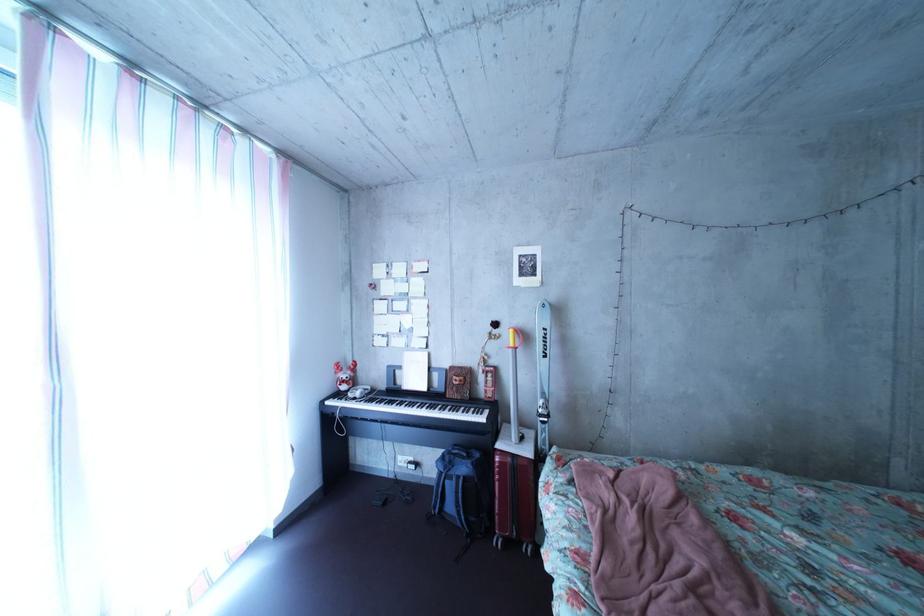
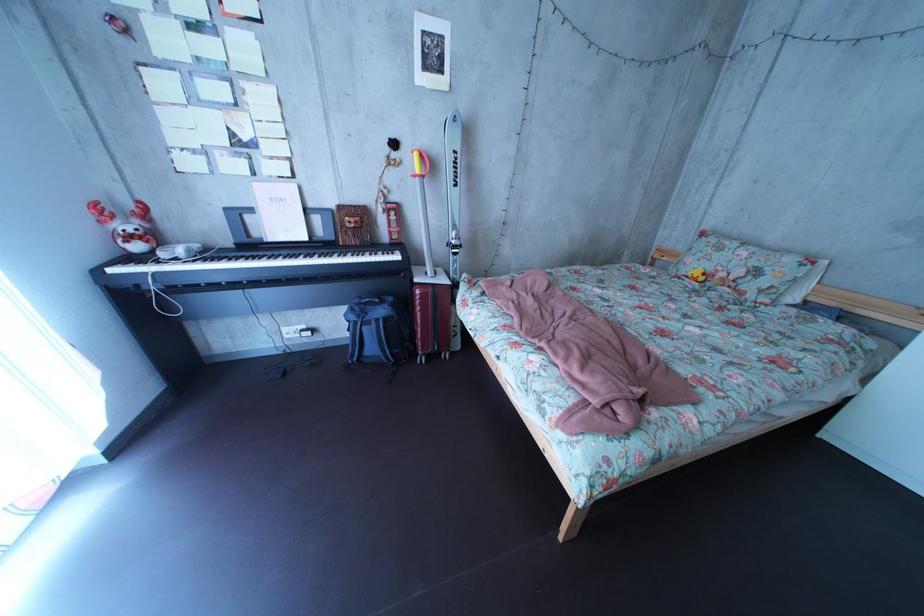
Find the pixel in the second image that matches point (368, 389) in the first image.

(169, 246)